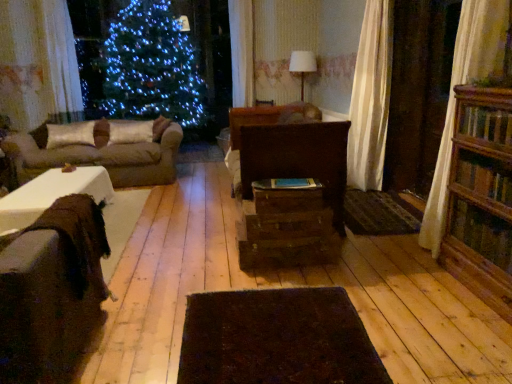
Question: Is dark brown textured mat at center oriented towards brown fuzzy studio couch at left, which ranks as the first studio couch in front-to-back order?

Choices:
 (A) yes
 (B) no

Answer: (B)

Question: Considering the relative sizes of dark brown textured mat at center and brown fuzzy studio couch at left, the second studio couch viewed from the back, in the image provided, is dark brown textured mat at center wider than brown fuzzy studio couch at left, the second studio couch viewed from the back,?

Choices:
 (A) no
 (B) yes

Answer: (A)

Question: From a real-world perspective, is dark brown textured mat at center beneath brown fuzzy studio couch at left, which ranks as the first studio couch in front-to-back order?

Choices:
 (A) no
 (B) yes

Answer: (B)

Question: Can you confirm if dark brown textured mat at center is positioned to the right of brown fuzzy studio couch at left, which ranks as the first studio couch in front-to-back order?

Choices:
 (A) yes
 (B) no

Answer: (A)

Question: Could brown fuzzy studio couch at left, the 2th studio couch in the top-to-bottom sequence, be considered to be inside dark brown textured mat at center?

Choices:
 (A) yes
 (B) no

Answer: (B)

Question: Is dark brown textured mat at center not near brown fuzzy studio couch at left, which ranks as the first studio couch in front-to-back order?

Choices:
 (A) yes
 (B) no

Answer: (A)

Question: Is dark brown rug at center behind wooden drawer at center, which ranks as the 1th drawer in bottom-to-top order?

Choices:
 (A) yes
 (B) no

Answer: (B)

Question: Considering the relative positions of dark brown rug at center and wooden drawer at center, placed as the 2th drawer when sorted from top to bottom, in the image provided, is dark brown rug at center to the left of wooden drawer at center, placed as the 2th drawer when sorted from top to bottom, from the viewer's perspective?

Choices:
 (A) no
 (B) yes

Answer: (B)

Question: Is dark brown rug at center facing towards wooden drawer at center, which ranks as the 1th drawer in bottom-to-top order?

Choices:
 (A) no
 (B) yes

Answer: (A)

Question: From the image's perspective, is dark brown rug at center over wooden drawer at center, which ranks as the 1th drawer in bottom-to-top order?

Choices:
 (A) no
 (B) yes

Answer: (A)

Question: Is dark brown rug at center far from wooden drawer at center, which ranks as the 1th drawer in bottom-to-top order?

Choices:
 (A) no
 (B) yes

Answer: (A)

Question: Can you confirm if dark brown rug at center is wider than wooden drawer at center, placed as the 2th drawer when sorted from top to bottom?

Choices:
 (A) yes
 (B) no

Answer: (A)

Question: Is wooden bookcase at right thinner than brown fabric couch at left, the first studio couch viewed from the top?

Choices:
 (A) yes
 (B) no

Answer: (A)